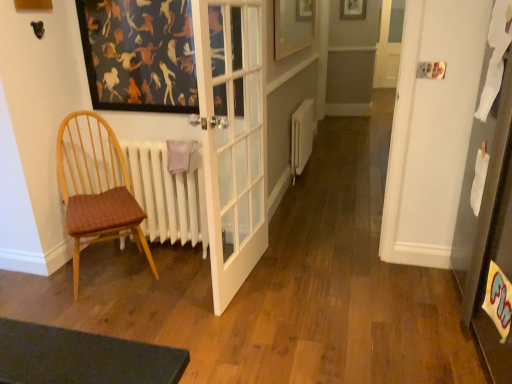
Question: In the image, is woven fabric chair at left positioned in front of or behind wooden picture frame at upper center, which is the 2th picture frame in back-to-front order?

Choices:
 (A) front
 (B) behind

Answer: (A)

Question: From the image's perspective, relative to wooden picture frame at upper center, the 2th picture frame when ordered from top to bottom, is woven fabric chair at left above or below?

Choices:
 (A) above
 (B) below

Answer: (B)

Question: Estimate the real-world distances between objects in this image. Which object is farther from the white matte radiator at left?

Choices:
 (A) wooden picture frame at upper center, which is counted as the first picture frame, starting from the top
 (B) woven fabric chair at left
 (C) white matte radiator at center
 (D) wooden picture frame at upper center, placed as the second picture frame when sorted from right to left

Answer: (A)

Question: Which of these objects is positioned closest to the white matte radiator at left?

Choices:
 (A) white matte radiator at center
 (B) woven fabric chair at left
 (C) wooden picture frame at upper center, which is counted as the first picture frame, starting from the top
 (D) wooden picture frame at upper center, placed as the second picture frame when sorted from right to left

Answer: (B)